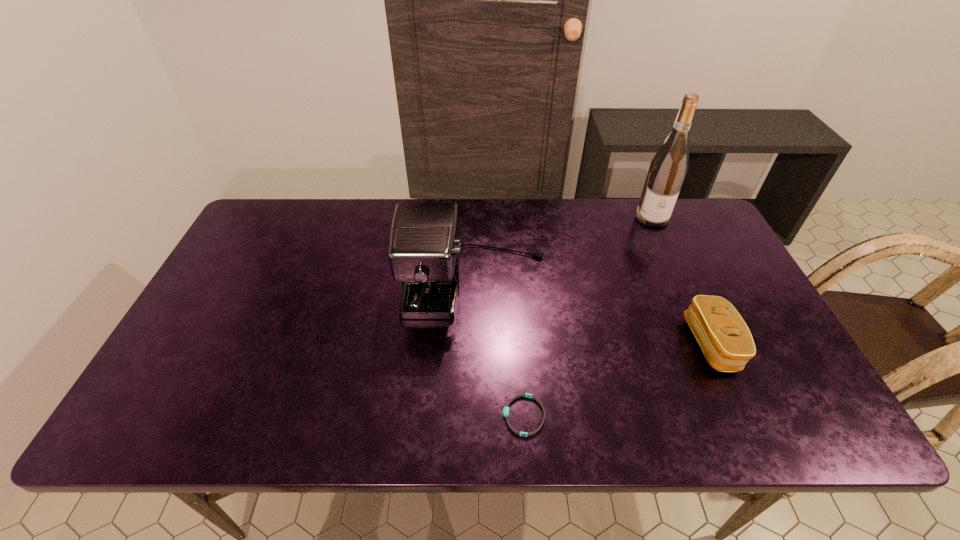
This screenshot has height=540, width=960. I want to click on the tallest object, so click(667, 171).

Locate an element on the screen. This screenshot has height=540, width=960. wine bottle is located at coordinates (667, 171).

Image resolution: width=960 pixels, height=540 pixels. In order to click on the second tallest object in this screenshot , I will do tap(424, 252).

Locate an element on the screen. The width and height of the screenshot is (960, 540). the third tallest object is located at coordinates (726, 341).

Where is `the shortest object`? the shortest object is located at coordinates (506, 409).

At what (x,y) coordinates should I click in order to perform the action: click on the nearest object. Please return your answer as a coordinate pair (x, y). The height and width of the screenshot is (540, 960). Looking at the image, I should click on (506, 409).

Identify the location of free space located on the front of the farthest object. The image size is (960, 540). click(x=692, y=304).

Locate an element on the screen. vacant region located on the front-facing side of the coffee maker is located at coordinates (472, 424).

Locate an element on the screen. free region located 0.140m on the zipper side of the second shortest object is located at coordinates (634, 344).

In order to click on vacant space positioned 0.160m on the zipper side of the second shortest object in this screenshot , I will do `click(625, 344)`.